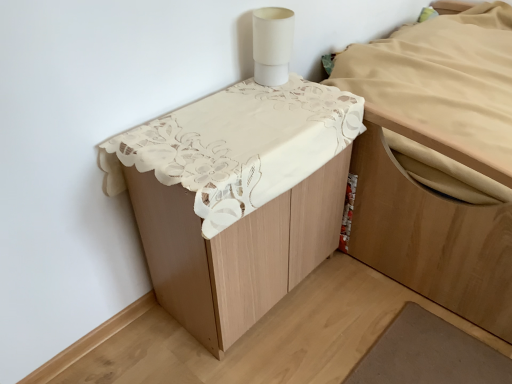
You are a GUI agent. You are given a task and a screenshot of the screen. Output one action in this format:
    pyautogui.click(x=<x>, y=<y>)
    Task: Click on the vacant point to the right of white lace tablecloth at upper center, acting as the second furniture starting from the right
    
    Given the screenshot: What is the action you would take?
    pyautogui.click(x=379, y=319)